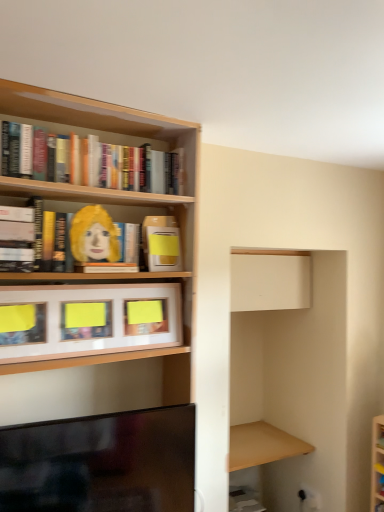
Where is `blank space situated above wooden at right (from a real-world perspective)`? This screenshot has height=512, width=384. blank space situated above wooden at right (from a real-world perspective) is located at coordinates (259, 441).